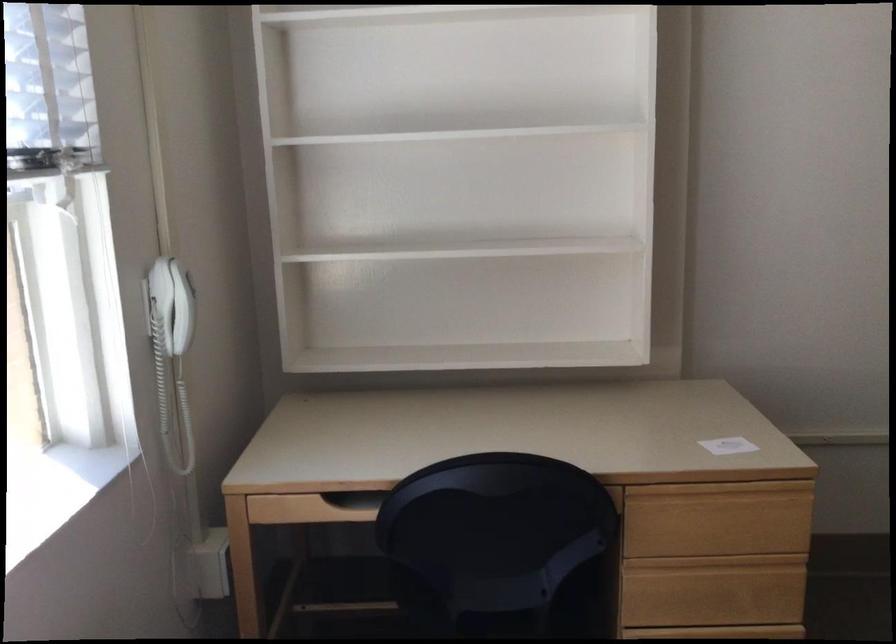
Describe the element at coordinates (349, 507) in the screenshot. This screenshot has height=644, width=896. I see `the drawer cutout handle` at that location.